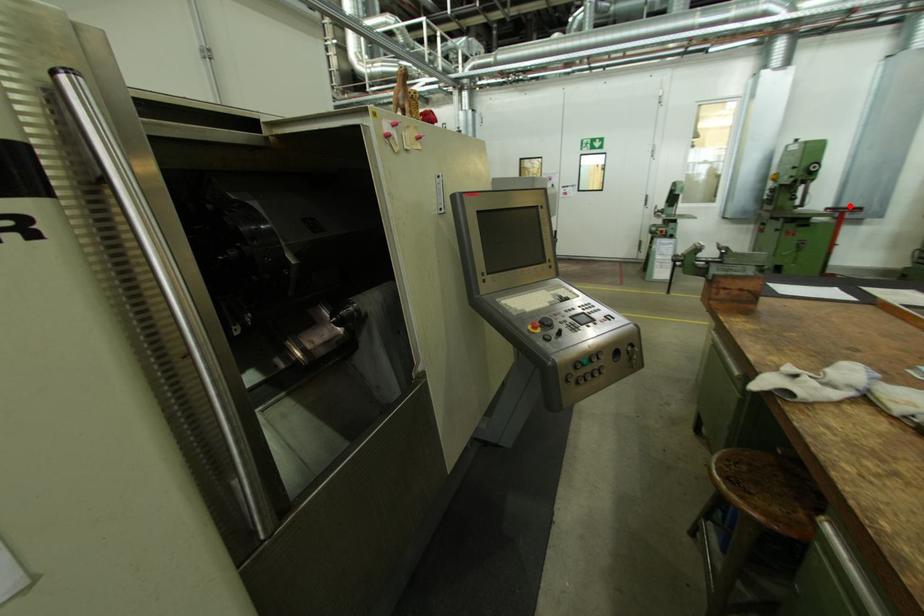
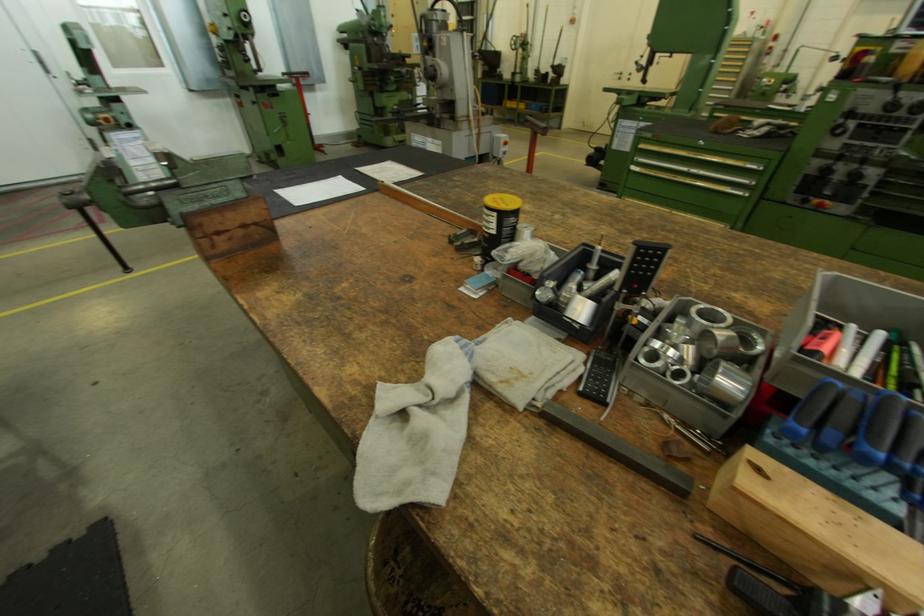
Question: I am providing you with two images of the same scene from different viewpoints. Image1 has a red point marked. In image2, the corresponding 3D location appears at what relative position? Reply with the corresponding letter.

Choices:
 (A) Closer
 (B) Farther

Answer: (A)